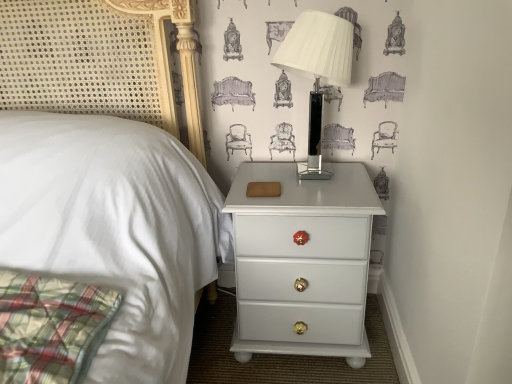
Question: From a real-world perspective, is white glossy nightstand at lower right positioned above or below white glossy table lamp at upper right?

Choices:
 (A) below
 (B) above

Answer: (A)

Question: Is white glossy nightstand at lower right bigger or smaller than white glossy table lamp at upper right?

Choices:
 (A) small
 (B) big

Answer: (B)

Question: Is white glossy nightstand at lower right in front of or behind white glossy table lamp at upper right in the image?

Choices:
 (A) front
 (B) behind

Answer: (B)

Question: In terms of size, does white glossy table lamp at upper right appear bigger or smaller than white glossy nightstand at lower right?

Choices:
 (A) small
 (B) big

Answer: (A)

Question: Is white glossy table lamp at upper right taller or shorter than white glossy nightstand at lower right?

Choices:
 (A) short
 (B) tall

Answer: (A)

Question: Is white glossy table lamp at upper right wider or thinner than white glossy nightstand at lower right?

Choices:
 (A) thin
 (B) wide

Answer: (A)

Question: Considering the relative positions of white glossy table lamp at upper right and white glossy nightstand at lower right in the image provided, is white glossy table lamp at upper right to the left or to the right of white glossy nightstand at lower right?

Choices:
 (A) right
 (B) left

Answer: (A)